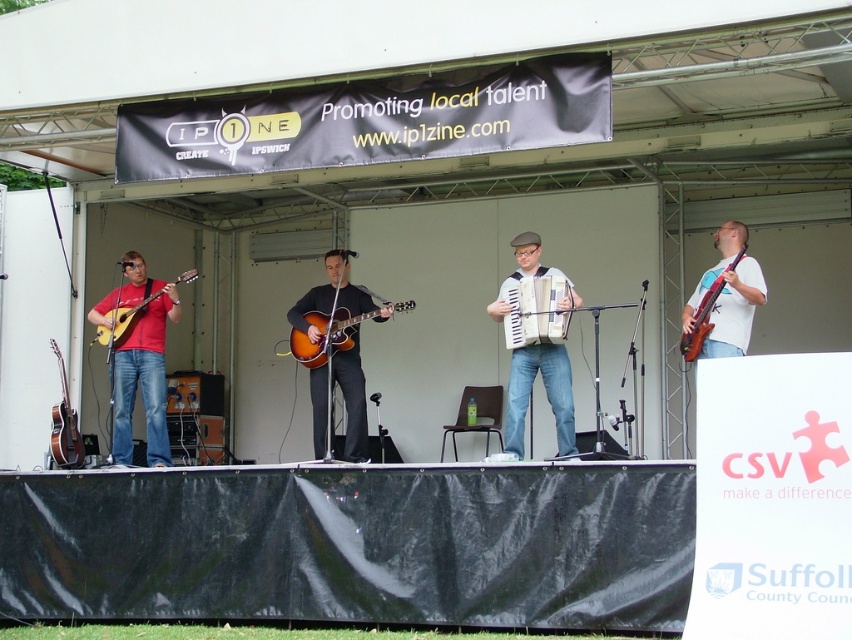
You are a photographer at the back of the venue. You want to capture a clear photo of the matte red shirt at left and the matte brown guitar at center. Which one is more likely to block the view of the other?

The matte red shirt at left is much taller as the matte brown guitar at center, so the matte red shirt at left is more likely to block the view of the matte brown guitar at center.

Consider the image. You are a photographer at the back of the stage. You want to take a photo of the matte black guitar at center and the matte brown acoustic guitar at center. Which one is positioned to the right of the other?

The matte black guitar at center is to the right of the matte brown acoustic guitar at center.